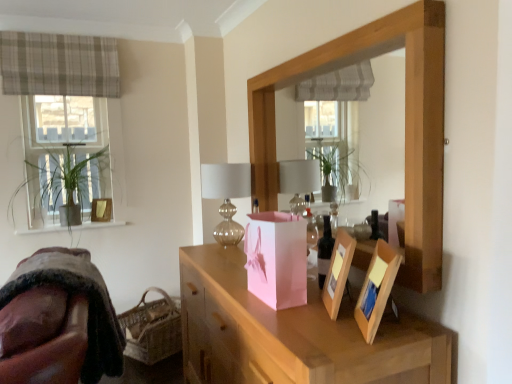
Where is `vacant region in front of pink paper bag at center`? This screenshot has width=512, height=384. vacant region in front of pink paper bag at center is located at coordinates (289, 322).